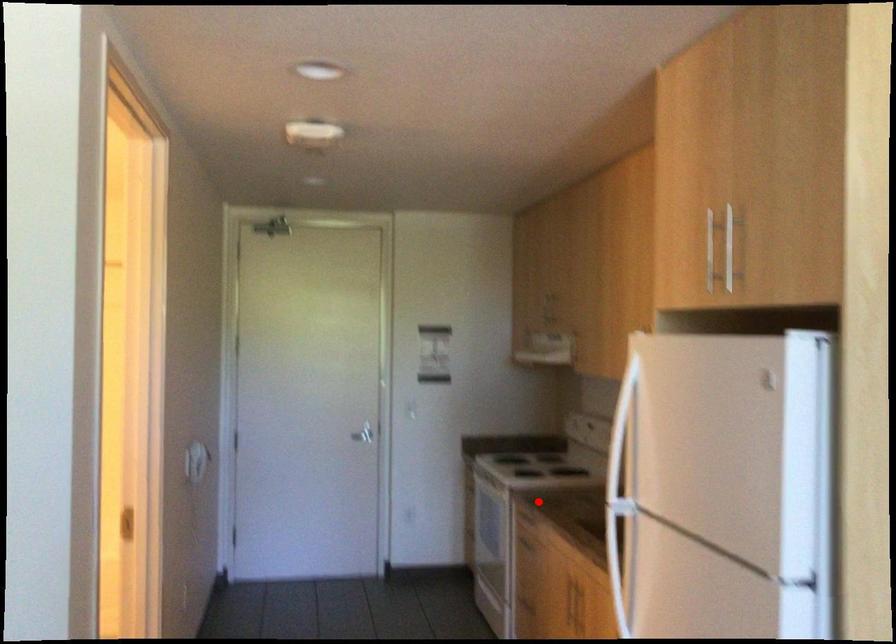
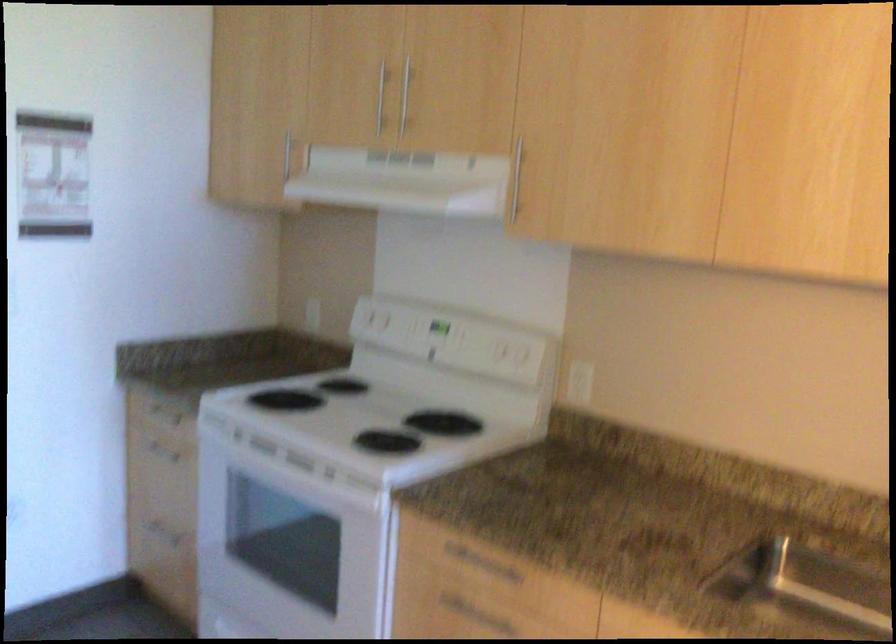
Question: I am providing you with two images of the same scene from different viewpoints. A red point is shown in image1. For the corresponding object point in image2, is it positioned nearer or farther from the camera?

Choices:
 (A) Nearer
 (B) Farther

Answer: (A)